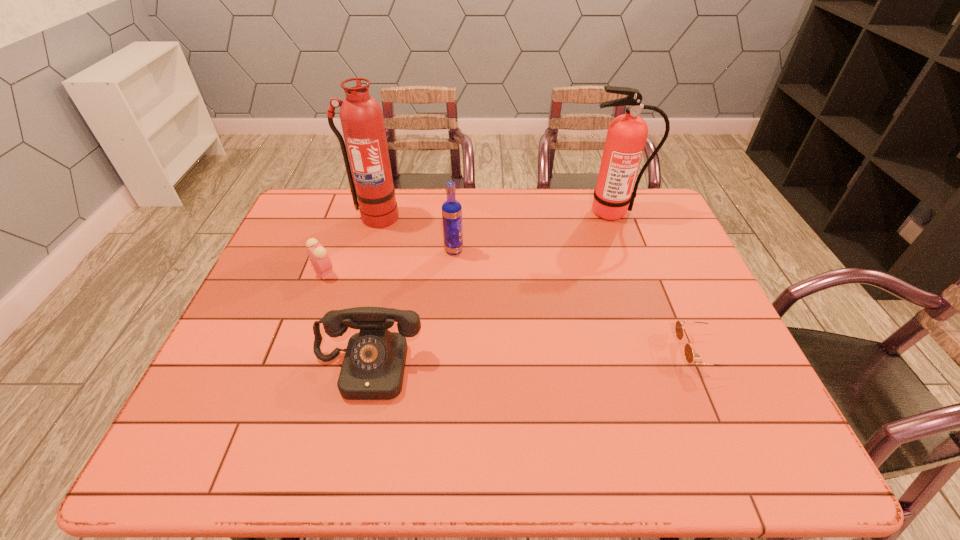
Where is `the left fire extinguisher`? The height and width of the screenshot is (540, 960). the left fire extinguisher is located at coordinates (361, 116).

The image size is (960, 540). I want to click on the right fire extinguisher, so click(627, 134).

You are a GUI agent. You are given a task and a screenshot of the screen. Output one action in this format:
    pyautogui.click(x=<x>, y=<y>)
    Task: Click on the third farthest object
    The width and height of the screenshot is (960, 540).
    Given the screenshot: What is the action you would take?
    pyautogui.click(x=451, y=209)

I want to click on the third object from right to left, so point(451,209).

At what (x,y) coordinates should I click in order to perform the action: click on telephone. Please return your answer as a coordinate pair (x, y). This screenshot has height=540, width=960. Looking at the image, I should click on (373, 368).

At what (x,y) coordinates should I click in order to perform the action: click on the fifth tallest object. Please return your answer as a coordinate pair (x, y). Looking at the image, I should click on (317, 254).

Find the location of `alarm clock`. alarm clock is located at coordinates (317, 254).

At what (x,y) coordinates should I click in order to perform the action: click on sunglasses. Please return your answer as a coordinate pair (x, y). The width and height of the screenshot is (960, 540). Looking at the image, I should click on (688, 351).

At what (x,y) coordinates should I click in order to perform the action: click on blank space located 0.400m on the label side of the left fire extinguisher. Please return your answer as a coordinate pair (x, y). Image resolution: width=960 pixels, height=540 pixels. Looking at the image, I should click on (345, 324).

Find the location of a particular element. The width and height of the screenshot is (960, 540). vacant region located 0.070m on the handle side of the right fire extinguisher is located at coordinates (621, 237).